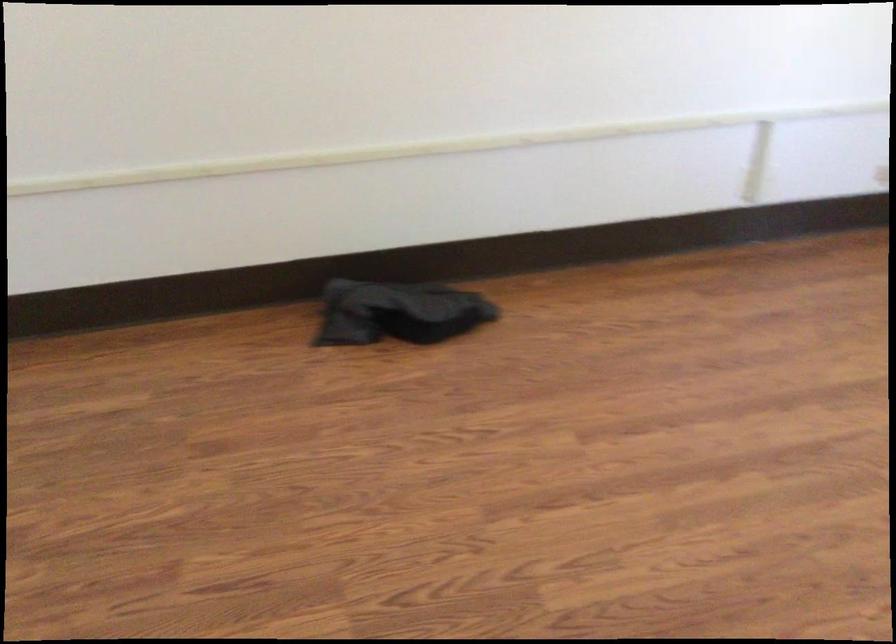
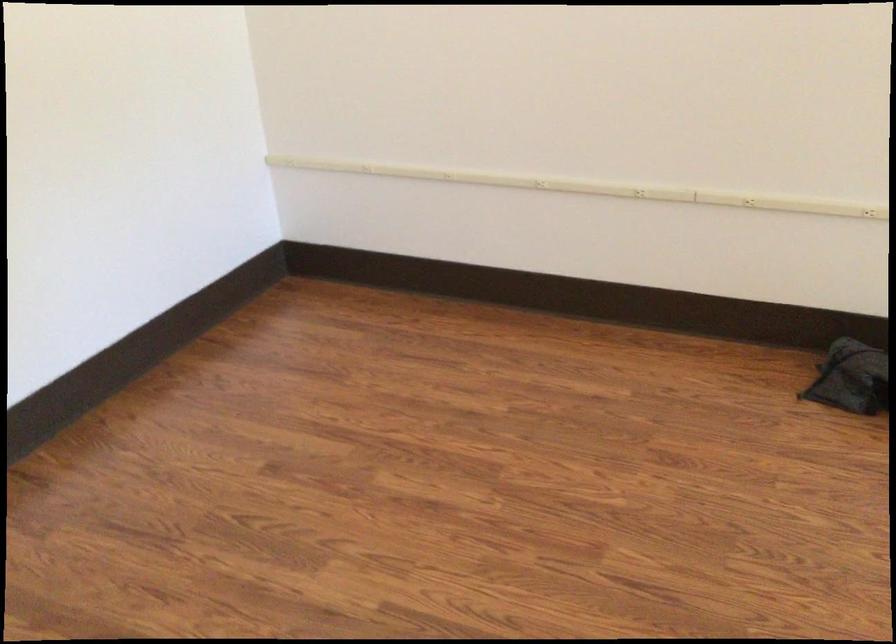
In the second image, find the point that corresponds to (x=82, y=174) in the first image.

(642, 182)